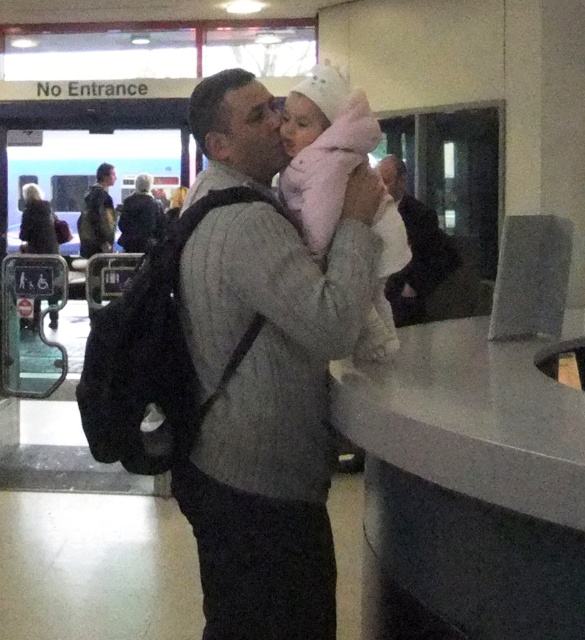
You are a security guard at the transportation hub. You need to check if the gray wool sweater at center is positioned to the left of the pink fluffy coat at center. Based on the scene, can you confirm this?

Yes, the gray wool sweater at center is to the left of the pink fluffy coat at center according to the description.

Consider the image. You are a traveler trying to pack your luggage efficiently. You have a camouflage fabric jacket at left and a dark gray backpack at center. Which item can fit into a smaller travel bag without needing to fold it?

The camouflage fabric jacket at left can fit into a smaller travel bag without needing to fold it because its width is less than the dark gray backpack at center.